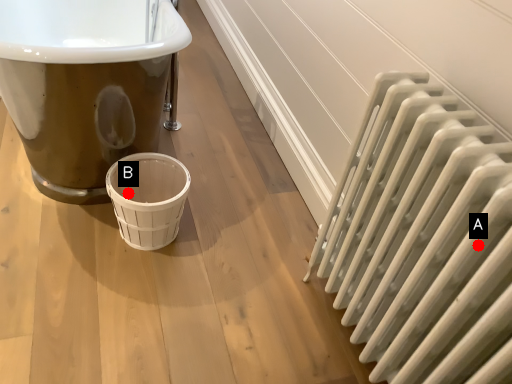
Question: Two points are circled on the image, labeled by A and B beside each circle. Which point is farther to the camera?

Choices:
 (A) A is further
 (B) B is further

Answer: (B)